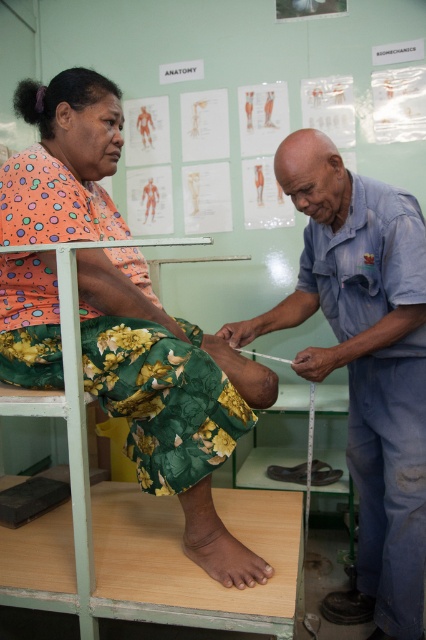
Which of these two, blue denim shirt at center or brown matte skin at lower center, stands taller?

blue denim shirt at center is taller.

You are a GUI agent. You are given a task and a screenshot of the screen. Output one action in this format:
    pyautogui.click(x=<x>, y=<y>)
    Task: Click on the blue denim shirt at center
    The image size is (426, 640).
    Given the screenshot: What is the action you would take?
    pyautogui.click(x=365, y=364)

Is point (74, 122) positioned behind point (351, 618)?

That is False.

Does green floral skirt at lower left have a greater height compared to blue denim shirt at center?

Incorrect, green floral skirt at lower left's height is not larger of blue denim shirt at center's.

Is point (28, 374) in front of point (409, 634)?

Yes.

I want to click on green floral skirt at lower left, so click(163, 378).

Consider the image. Does green floral skirt at lower left have a greater height compared to brown matte skin at lower center?

Yes, green floral skirt at lower left is taller than brown matte skin at lower center.

Find the location of a particular element. This screenshot has height=640, width=426. green floral skirt at lower left is located at coordinates (163, 378).